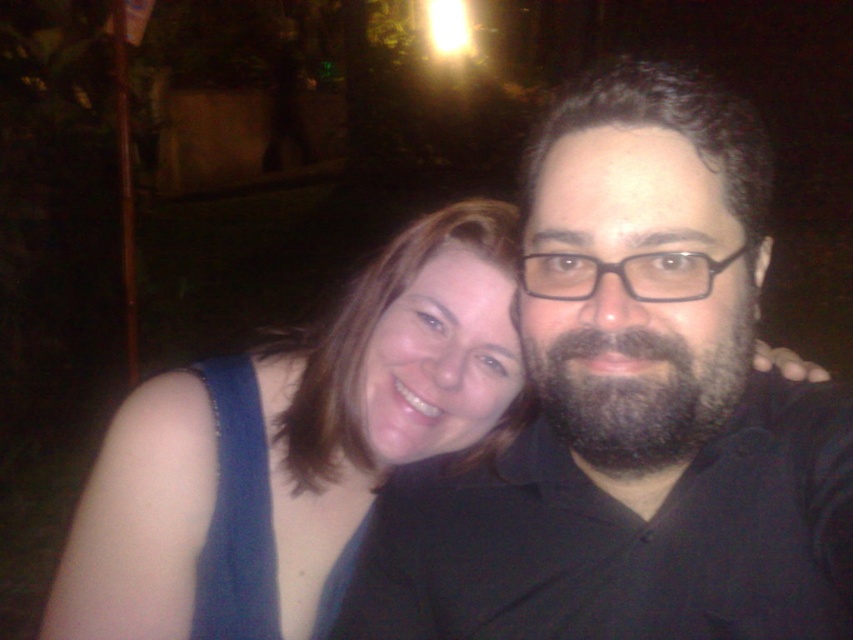
You are a photographer trying to adjust the lighting for a portrait. You notice the black matte shirt at center and the dark brown thick beard at center in the frame. Which object is positioned to the left side of the other?

The black matte shirt at center is to the left of dark brown thick beard at center according to the description.

You are a photographer trying to frame a closeup shot of both the black matte shirt at center and the dark brown thick beard at center. Can you fit both into the frame if the frame width is exactly the same as the combined width of the two objects?

The black matte shirt at center might be wider than dark brown thick beard at center, so the combined width of both objects could exceed the frame width. Therefore, it might not fit both into the frame.

You are a photographer trying to adjust the lighting for a night portrait. You notice the dark brown thick beard at center and the denim fabric dress at left. Which of these two objects is closer to the camera based on their height in the image?

The dark brown thick beard at center is shorter than the denim fabric dress at left, so the dark brown thick beard at center is closer to the camera.